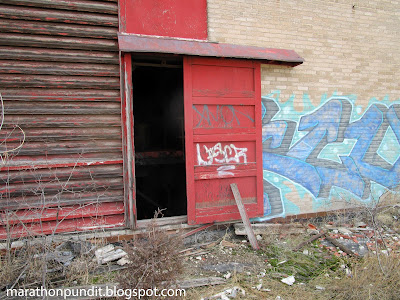
Locate an element on the screen. door is located at coordinates (206, 130).